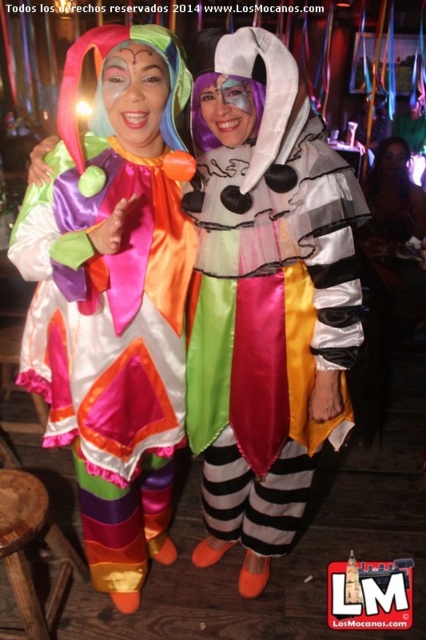
Question: Can you confirm if satin/rich fabric costume at left is thinner than wooden stool at lower left?

Choices:
 (A) no
 (B) yes

Answer: (A)

Question: Among these objects, which one is farthest from the camera?

Choices:
 (A) satin/rich fabric costume at left
 (B) wooden stool at lower left

Answer: (B)

Question: Which of the following is the closest to the observer?

Choices:
 (A) wooden stool at lower left
 (B) satin/rich fabric costume at left

Answer: (B)

Question: Can you confirm if satin/rich fabric costume at left is positioned above wooden stool at lower left?

Choices:
 (A) yes
 (B) no

Answer: (A)

Question: Where is satin/rich fabric costume at left located in relation to wooden stool at lower left in the image?

Choices:
 (A) above
 (B) below

Answer: (A)